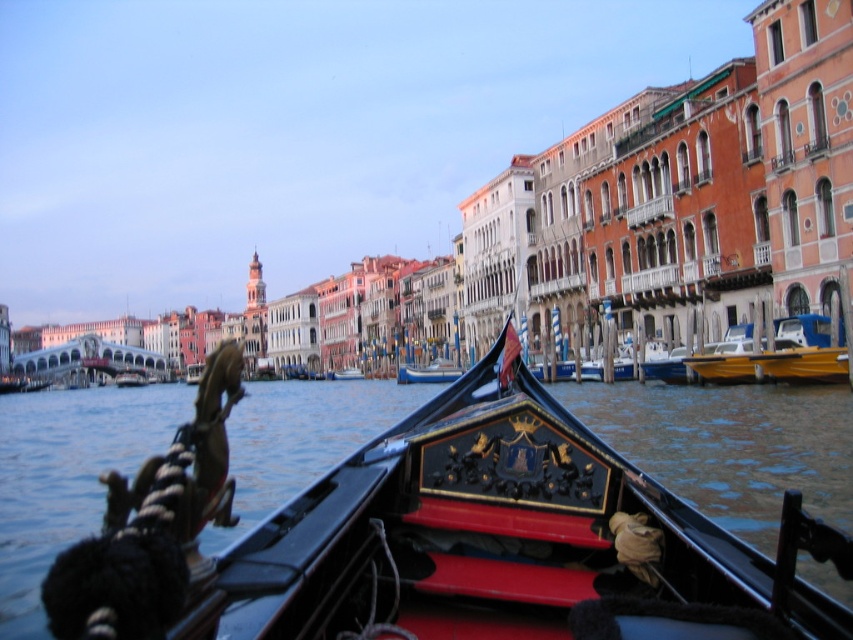
Can you confirm if glossy water at center is taller than wooden gondola at center?

Yes, glossy water at center is taller than wooden gondola at center.

Does glossy water at center have a smaller size compared to wooden gondola at center?

Incorrect, glossy water at center is not smaller in size than wooden gondola at center.

Which is behind, point (138, 422) or point (401, 364)?

Positioned behind is point (401, 364).

Image resolution: width=853 pixels, height=640 pixels. Find the location of `glossy water at center`. glossy water at center is located at coordinates (732, 444).